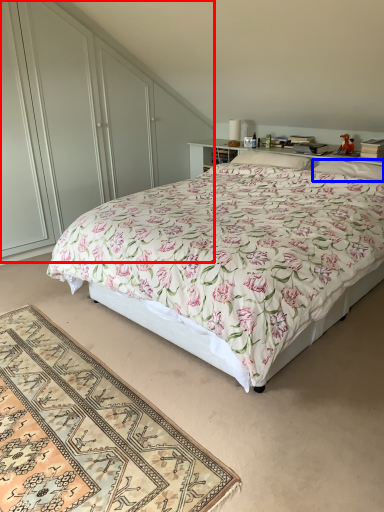
Question: Which object appears farthest to the camera in this image, dresser (highlighted by a red box) or pillow (highlighted by a blue box)?

Choices:
 (A) dresser
 (B) pillow

Answer: (B)